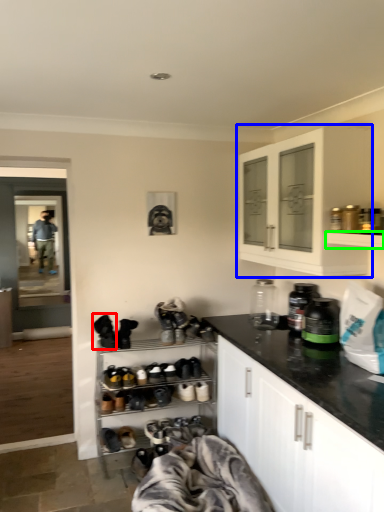
Question: Considering the real-world distances, which object is closest to shoe (highlighted by a red box)? cabinetry (highlighted by a blue box) or shelf (highlighted by a green box).

Choices:
 (A) cabinetry
 (B) shelf

Answer: (A)